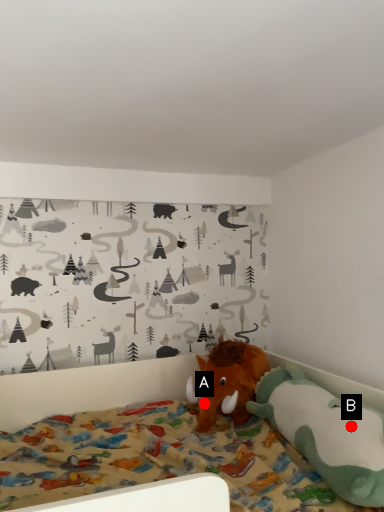
Question: Two points are circled on the image, labeled by A and B beside each circle. Which point is farther to the camera?

Choices:
 (A) A is further
 (B) B is further

Answer: (A)